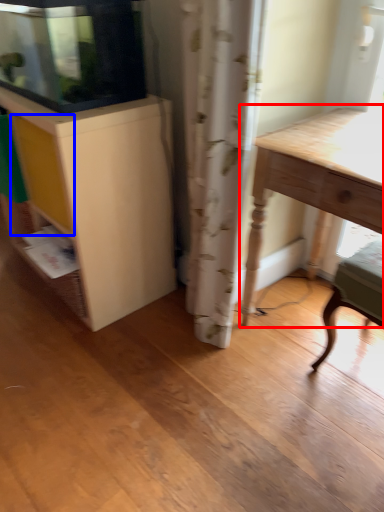
Question: Among these objects, which one is nearest to the camera, table (highlighted by a red box) or drawer (highlighted by a blue box)?

Choices:
 (A) table
 (B) drawer

Answer: (A)